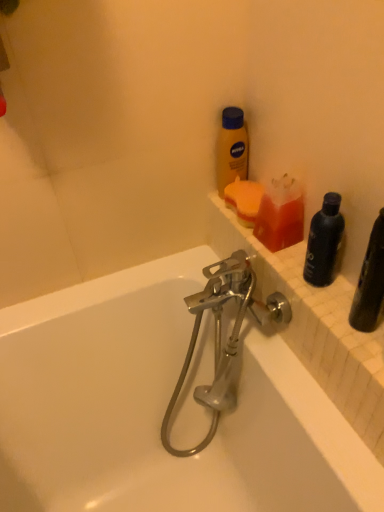
Question: Is orange sponge at upper right, which is the first cleaning product from back to front, inside or outside of chrome metallic faucet at center?

Choices:
 (A) outside
 (B) inside

Answer: (A)

Question: Is orange sponge at upper right, which is the first cleaning product from back to front, to the left or to the right of chrome metallic faucet at center in the image?

Choices:
 (A) left
 (B) right

Answer: (B)

Question: Which object is the closest to the translucent orange soap at upper right, the 2th cleaning product viewed from the back?

Choices:
 (A) yellow matte lotion at upper center, the second bottle positioned from the bottom
 (B) black matte bottle at right, marked as the 2th bottle in a back-to-front arrangement
 (C) orange sponge at upper right, which is the first cleaning product from back to front
 (D) chrome metallic faucet at center
 (E) white tile ledge at upper right

Answer: (C)

Question: Estimate the real-world distances between objects in this image. Which object is closer to the black matte bottle at right, the 1th bottle viewed from the front?

Choices:
 (A) yellow matte lotion at upper center, the second bottle positioned from the bottom
 (B) chrome metallic faucet at center
 (C) translucent orange soap at upper right, placed as the 1th cleaning product when sorted from front to back
 (D) white tile ledge at upper right
 (E) orange sponge at upper right, the 2th cleaning product when ordered from front to back

Answer: (C)